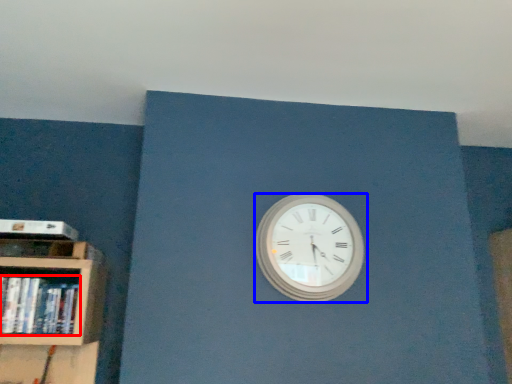
Question: Among these objects, which one is farthest to the camera, book (highlighted by a red box) or wall clock (highlighted by a blue box)?

Choices:
 (A) book
 (B) wall clock

Answer: (B)